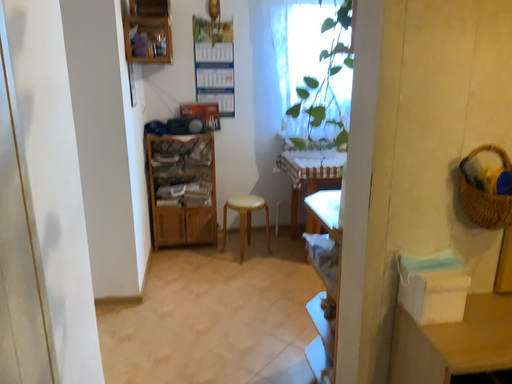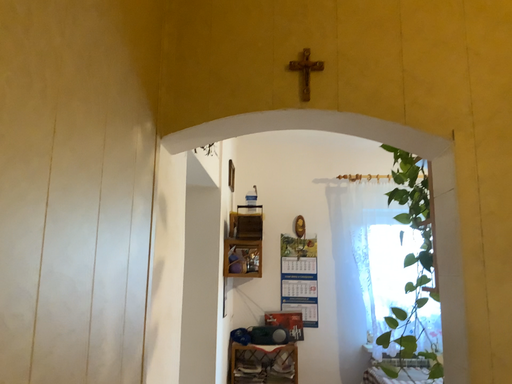
Question: How did the camera likely rotate when shooting the video?

Choices:
 (A) rotated left
 (B) rotated right

Answer: (A)